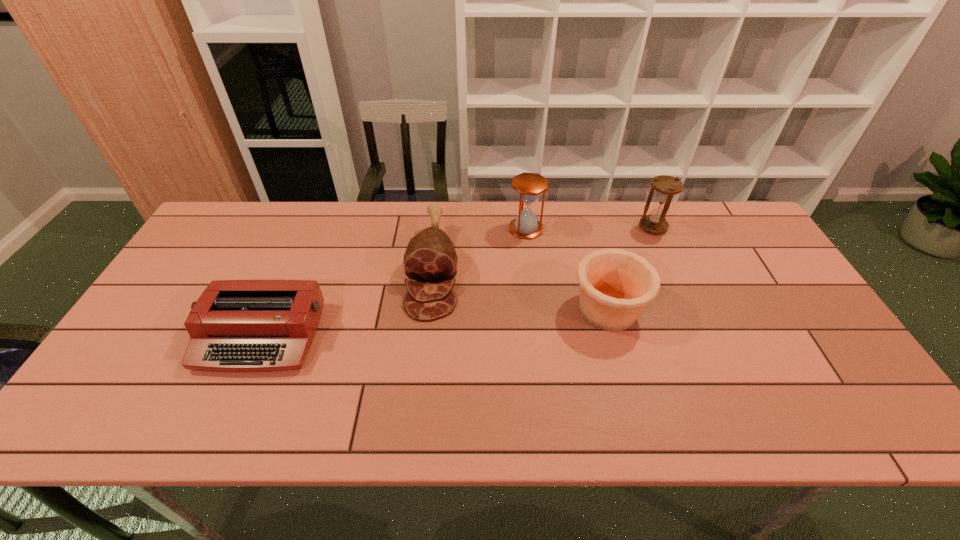
The width and height of the screenshot is (960, 540). I want to click on free space between the pottery and the fourth object from right to left, so click(520, 289).

The image size is (960, 540). Find the location of `free spot between the third object from left to right and the fourth object from left to right`. free spot between the third object from left to right and the fourth object from left to right is located at coordinates (567, 269).

Where is `vacant space that's between the fourth object from right to left and the leftmost object`? This screenshot has width=960, height=540. vacant space that's between the fourth object from right to left and the leftmost object is located at coordinates (347, 302).

Where is `vacant area that lies between the shortest object and the third object from left to right`? This screenshot has width=960, height=540. vacant area that lies between the shortest object and the third object from left to right is located at coordinates (394, 282).

I want to click on vacant region between the left hourglass and the ham, so click(x=479, y=249).

At what (x,y) coordinates should I click in order to perform the action: click on vacant area between the right hourglass and the typewriter. Please return your answer as a coordinate pair (x, y). Image resolution: width=960 pixels, height=540 pixels. Looking at the image, I should click on (457, 282).

I want to click on object that is the closest to the pottery, so click(529, 186).

The width and height of the screenshot is (960, 540). I want to click on object identified as the third closest to the right hourglass, so click(x=430, y=257).

Find the location of a particular element. The height and width of the screenshot is (540, 960). free point that satisfies the following two spatial constraints: 1. on the back side of the right hourglass; 2. on the right side of the third object from left to right is located at coordinates (526, 227).

What are the coordinates of `vacant region that satisfies the following two spatial constraints: 1. on the back side of the fourth object from left to right; 2. on the right side of the rightmost object` in the screenshot? It's located at (586, 227).